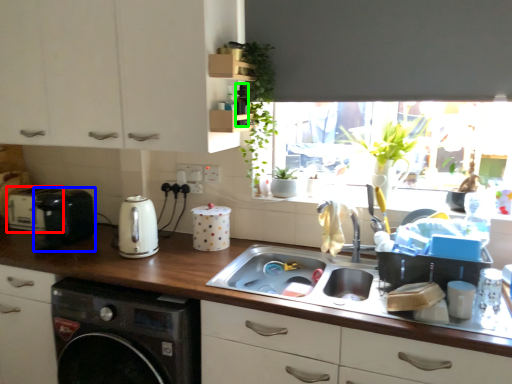
Question: Which is nearer to the appliance (highlighted by a red box)? appliance (highlighted by a blue box) or bottle (highlighted by a green box).

Choices:
 (A) appliance
 (B) bottle

Answer: (A)